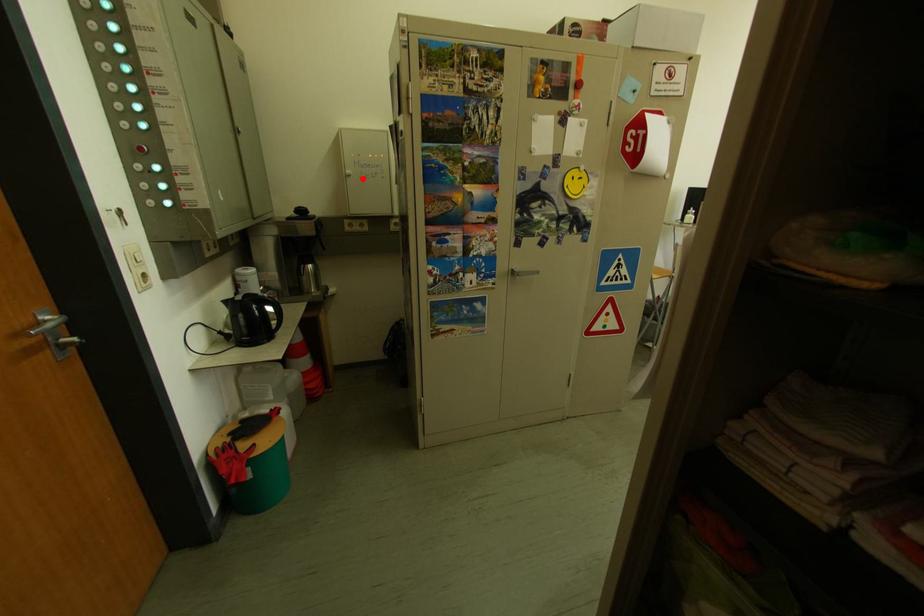
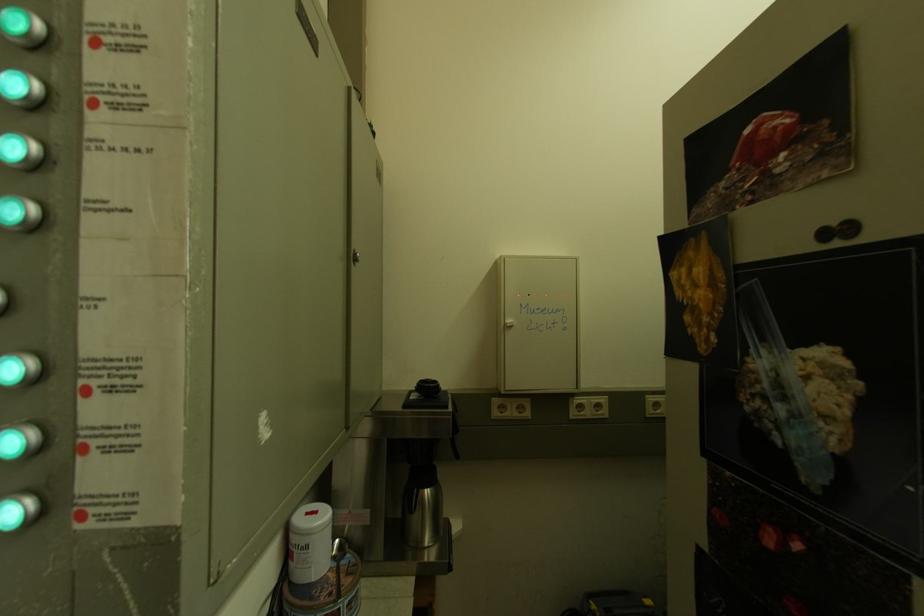
Question: I am providing you with two images of the same scene from different viewpoints. A red point is shown in image1. For the corresponding object point in image2, is it positioned nearer or farther from the camera?

Choices:
 (A) Nearer
 (B) Farther

Answer: (B)